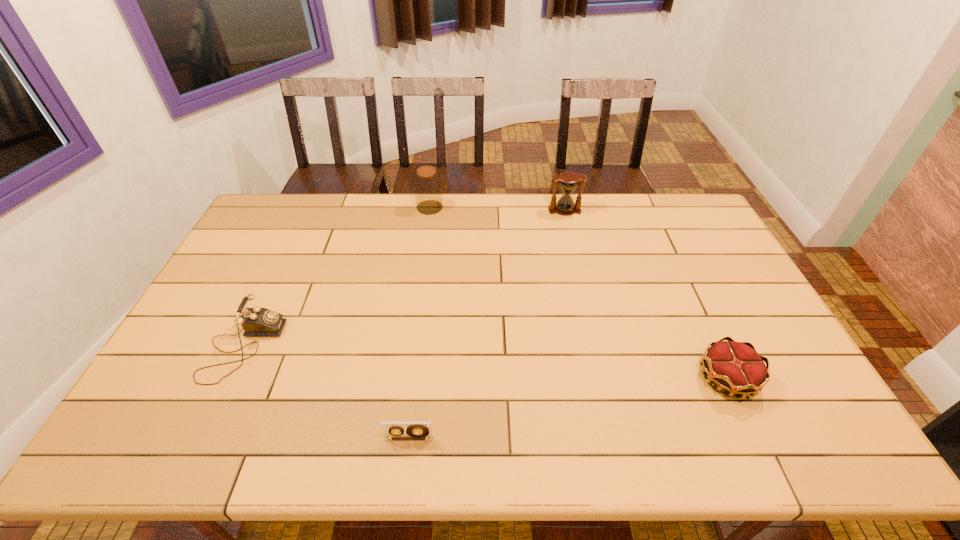
Identify the location of vacant space that is in between the hourglass and the nearest object. (487, 325).

You are a GUI agent. You are given a task and a screenshot of the screen. Output one action in this format:
    pyautogui.click(x=<x>, y=<y>)
    Task: Click on the object that stands as the second closest to the crown
    Image resolution: width=960 pixels, height=540 pixels.
    Given the screenshot: What is the action you would take?
    pyautogui.click(x=415, y=430)

Find the location of `object that stands as the closest to the shortest object`. object that stands as the closest to the shortest object is located at coordinates (256, 321).

This screenshot has height=540, width=960. Identify the location of vacant position in the image that satisfies the following two spatial constraints: 1. on the dial of the telephone; 2. on the right side of the rightmost object. (228, 378).

The image size is (960, 540). In order to click on free space that satisfies the following two spatial constraints: 1. on the back side of the rightmost object; 2. on the dial of the telephone in this screenshot , I will do `click(713, 348)`.

At what (x,y) coordinates should I click in order to perform the action: click on vacant space that satisfies the following two spatial constraints: 1. on the front side of the fourth object from left to right; 2. on the left side of the jar. Please return your answer as a coordinate pair (x, y). The image size is (960, 540). Looking at the image, I should click on (429, 211).

The height and width of the screenshot is (540, 960). I want to click on blank space that satisfies the following two spatial constraints: 1. on the dial of the leftmost object; 2. on the back side of the crown, so click(x=228, y=378).